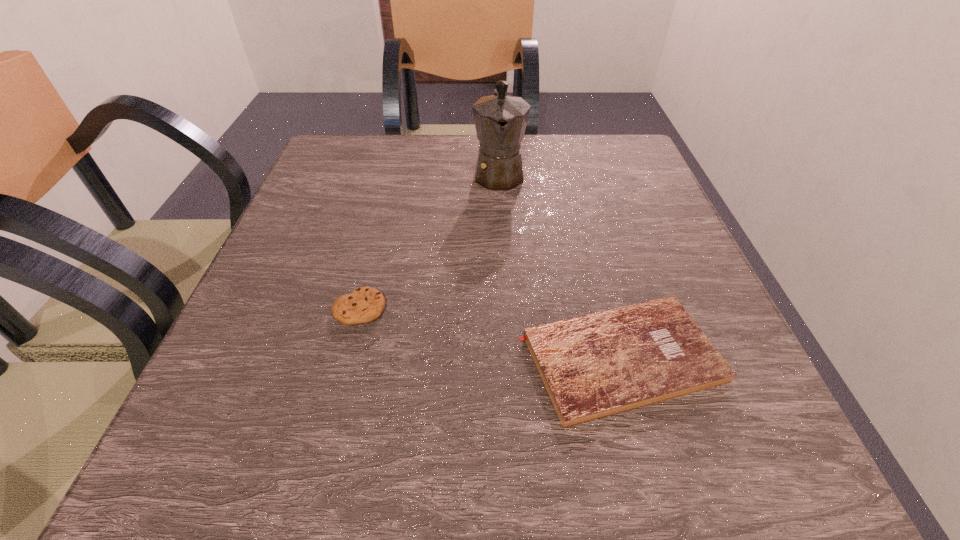
Find the location of a particular element. This screenshot has width=960, height=540. free spot that satisfies the following two spatial constraints: 1. on the pouring side of the Bible; 2. on the left side of the farthest object is located at coordinates (509, 359).

Identify the location of vacant region that satisfies the following two spatial constraints: 1. on the pouring side of the Bible; 2. on the left side of the farthest object. (509, 359).

This screenshot has height=540, width=960. Find the location of `free location that satisfies the following two spatial constraints: 1. on the pouring side of the farthest object; 2. on the left side of the Bible`. free location that satisfies the following two spatial constraints: 1. on the pouring side of the farthest object; 2. on the left side of the Bible is located at coordinates (509, 359).

Identify the location of free space that satisfies the following two spatial constraints: 1. on the pouring side of the Bible; 2. on the right side of the farthest object. The width and height of the screenshot is (960, 540). (509, 359).

The image size is (960, 540). In order to click on free spot that satisfies the following two spatial constraints: 1. on the pouring side of the tallest object; 2. on the right side of the Bible in this screenshot , I will do `click(509, 359)`.

Where is `vacant space that satisfies the following two spatial constraints: 1. on the pouring side of the tallest object; 2. on the right side of the Bible`? vacant space that satisfies the following two spatial constraints: 1. on the pouring side of the tallest object; 2. on the right side of the Bible is located at coordinates (509, 359).

At what (x,y) coordinates should I click in order to perform the action: click on free space that satisfies the following two spatial constraints: 1. on the pouring side of the Bible; 2. on the right side of the tallest object. Please return your answer as a coordinate pair (x, y). Image resolution: width=960 pixels, height=540 pixels. Looking at the image, I should click on (509, 359).